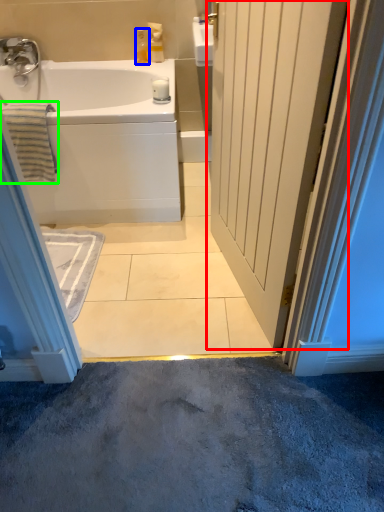
Question: Estimate the real-world distances between objects in this image. Which object is farther from door (highlighted by a red box), toiletry (highlighted by a blue box) or bath towel (highlighted by a green box)?

Choices:
 (A) toiletry
 (B) bath towel

Answer: (A)